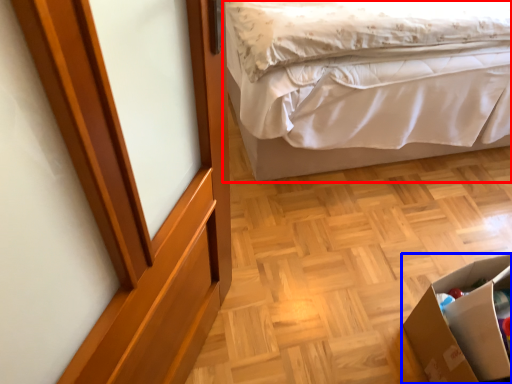
Question: Which object appears closest to the camera in this image, bed (highlighted by a red box) or cardboard box (highlighted by a blue box)?

Choices:
 (A) bed
 (B) cardboard box

Answer: (B)